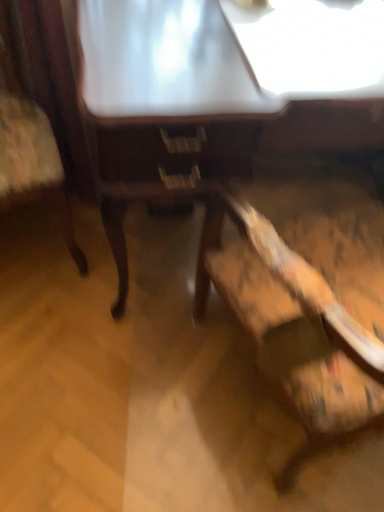
The height and width of the screenshot is (512, 384). What are the coordinates of `wooden chair at left, the first chair positioned from the left` in the screenshot? It's located at [41, 108].

From a real-world perspective, which is physically below, wooden table at center or wooden chair at lower right, which is the 1th chair from right to left?

In real-world perspective, wooden table at center is lower.

Does wooden table at center have a greater height compared to wooden chair at lower right, which is the 1th chair from right to left?

No, wooden table at center is not taller than wooden chair at lower right, which is the 1th chair from right to left.

From their relative heights in the image, would you say wooden chair at lower right, which is the 1th chair from right to left, is taller or shorter than wooden table at center?

In the image, wooden chair at lower right, which is the 1th chair from right to left, appears to be taller than wooden table at center.

Is wooden chair at lower right, the 2th chair from the left, situated inside wooden table at center or outside?

wooden chair at lower right, the 2th chair from the left, lies outside wooden table at center.

In terms of size, does wooden chair at lower right, which is the 1th chair from right to left, appear bigger or smaller than wooden table at center?

In the image, wooden chair at lower right, which is the 1th chair from right to left, appears to be smaller than wooden table at center.

Based on the photo, is wooden chair at lower right, which is the 1th chair from right to left, oriented away from wooden table at center?

No, wooden chair at lower right, which is the 1th chair from right to left,'s orientation is not away from wooden table at center.

Between wooden chair at left, placed as the second chair when sorted from right to left, and wooden table at center, which one appears on the right side from the viewer's perspective?

wooden table at center is more to the right.

At what (x,y) coordinates should I click in order to perform the action: click on chair above the wooden table at center (from the image's perspective). Please return your answer as a coordinate pair (x, y). This screenshot has height=512, width=384. Looking at the image, I should click on (41, 108).

Which is closer, (2, 194) or (165, 196)?

The point (165, 196) is closer to the camera.

From a real-world perspective, between wooden table at center and wooden chair at left, placed as the second chair when sorted from right to left, who is vertically lower?

wooden table at center is physically lower.

From the picture: Between wooden table at center and wooden chair at left, placed as the second chair when sorted from right to left, which one is positioned behind?

wooden table at center is behind.

The height and width of the screenshot is (512, 384). I want to click on table that appears behind the wooden chair at left, placed as the second chair when sorted from right to left, so click(164, 106).

Is wooden table at center oriented towards wooden chair at left, placed as the second chair when sorted from right to left?

No.

Is wooden chair at left, placed as the second chair when sorted from right to left, closer to the viewer compared to wooden chair at lower right, the 2th chair from the left?

No, it is behind wooden chair at lower right, the 2th chair from the left.

Could you tell me if wooden chair at left, the first chair positioned from the left, is facing wooden chair at lower right, which is the 1th chair from right to left?

No, wooden chair at left, the first chair positioned from the left, is not oriented towards wooden chair at lower right, which is the 1th chair from right to left.

Considering the relative sizes of wooden chair at left, the first chair positioned from the left, and wooden chair at lower right, the 2th chair from the left, in the image provided, is wooden chair at left, the first chair positioned from the left, wider than wooden chair at lower right, the 2th chair from the left,?

Incorrect, the width of wooden chair at left, the first chair positioned from the left, does not surpass that of wooden chair at lower right, the 2th chair from the left.

Locate an element on the screen. chair that is above the wooden chair at lower right, which is the 1th chair from right to left (from the image's perspective) is located at coordinates (41, 108).

From the image's perspective, is wooden chair at lower right, the 2th chair from the left, positioned above or below wooden chair at left, placed as the second chair when sorted from right to left?

From the image's perspective, wooden chair at lower right, the 2th chair from the left, appears below wooden chair at left, placed as the second chair when sorted from right to left.

Is wooden chair at lower right, the 2th chair from the left, with wooden chair at left, placed as the second chair when sorted from right to left?

wooden chair at lower right, the 2th chair from the left, and wooden chair at left, placed as the second chair when sorted from right to left, are not in contact.

Does wooden chair at lower right, which is the 1th chair from right to left, have a lesser width compared to wooden chair at left, the first chair positioned from the left?

In fact, wooden chair at lower right, which is the 1th chair from right to left, might be wider than wooden chair at left, the first chair positioned from the left.

Find the location of a particular element. table above the wooden chair at lower right, the 2th chair from the left (from the image's perspective) is located at coordinates (164, 106).

Find the location of a particular element. table that appears on the left of wooden chair at lower right, which is the 1th chair from right to left is located at coordinates (164, 106).

When comparing their distances from wooden chair at left, the first chair positioned from the left, does wooden chair at lower right, the 2th chair from the left, or wooden table at center seem closer?

The object closer to wooden chair at left, the first chair positioned from the left, is wooden table at center.

Looking at the image, which one is located closer to wooden chair at lower right, which is the 1th chair from right to left, wooden chair at left, placed as the second chair when sorted from right to left, or wooden table at center?

Among the two, wooden table at center is located nearer to wooden chair at lower right, which is the 1th chair from right to left.

Considering their positions, is wooden table at center positioned further to wooden chair at lower right, which is the 1th chair from right to left, than wooden chair at left, the first chair positioned from the left?

wooden chair at left, the first chair positioned from the left, is positioned further to the anchor wooden chair at lower right, which is the 1th chair from right to left.

Based on their spatial positions, is wooden table at center or wooden chair at lower right, the 2th chair from the left, closer to wooden chair at left, placed as the second chair when sorted from right to left?

wooden table at center is positioned closer to the anchor wooden chair at left, placed as the second chair when sorted from right to left.

When comparing their distances from wooden table at center, does wooden chair at left, the first chair positioned from the left, or wooden chair at lower right, the 2th chair from the left, seem closer?

wooden chair at lower right, the 2th chair from the left, is positioned closer to the anchor wooden table at center.

Looking at this image, when comparing their distances from wooden table at center, does wooden chair at lower right, the 2th chair from the left, or wooden chair at left, placed as the second chair when sorted from right to left, seem closer?

wooden chair at lower right, the 2th chair from the left, is positioned closer to the anchor wooden table at center.

Where is `table situated between wooden chair at left, placed as the second chair when sorted from right to left, and wooden chair at lower right, the 2th chair from the left, from left to right`? table situated between wooden chair at left, placed as the second chair when sorted from right to left, and wooden chair at lower right, the 2th chair from the left, from left to right is located at coordinates (164, 106).